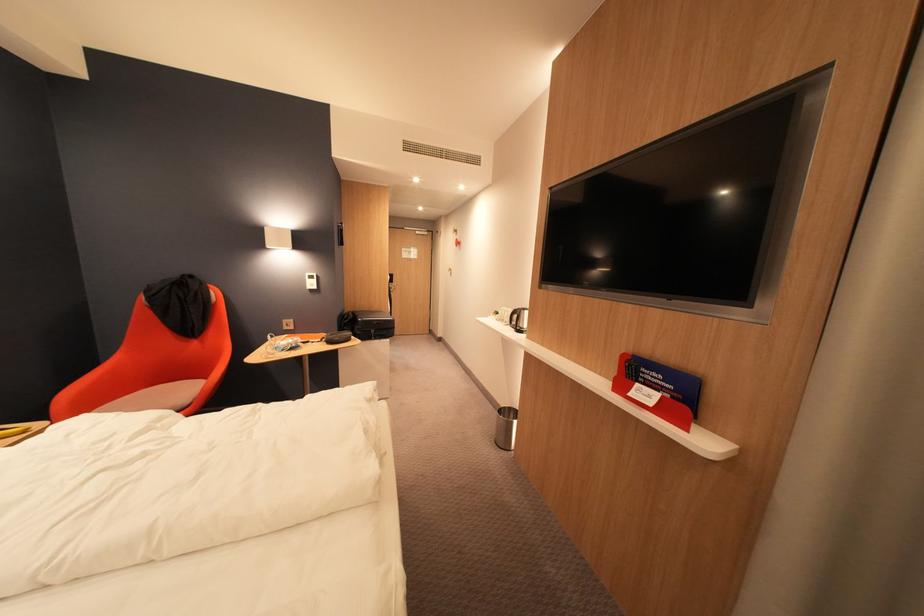
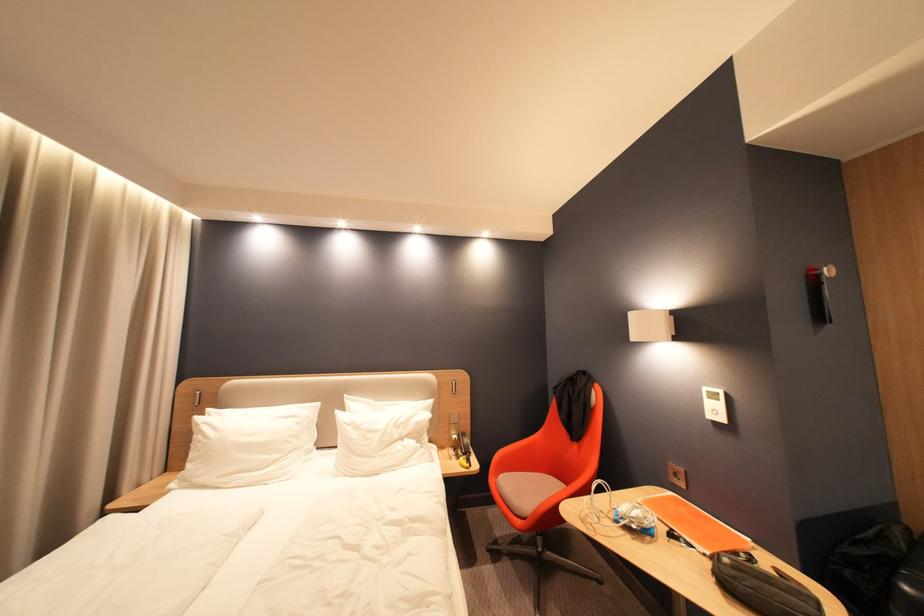
Where in the second image is the point corresponding to (x=329, y=342) from the first image?

(714, 556)